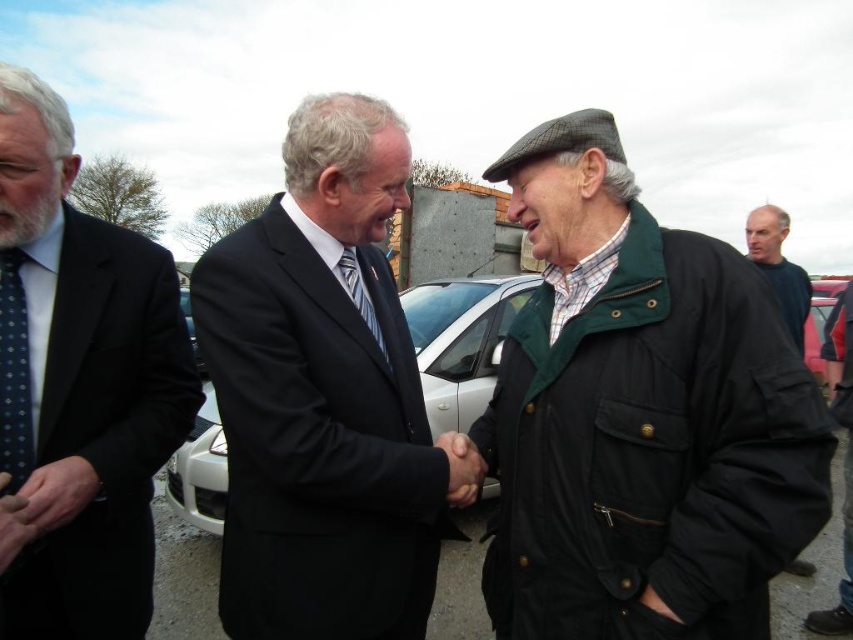
Between green textured jacket at center and dark blue dotted tie at left, which one appears on the right side from the viewer's perspective?

green textured jacket at center

Who is lower down, green textured jacket at center or dark blue dotted tie at left?

green textured jacket at center

Is point (666, 250) more distant than point (0, 404)?

Yes, it is behind point (0, 404).

The height and width of the screenshot is (640, 853). In order to click on green textured jacket at center in this screenshot , I will do `click(639, 417)`.

Based on the photo, does green textured jacket at center have a lesser height compared to polka dot silk tie at center?

Incorrect, green textured jacket at center's height does not fall short of polka dot silk tie at center's.

Is green textured jacket at center to the left of polka dot silk tie at center from the viewer's perspective?

In fact, green textured jacket at center is to the right of polka dot silk tie at center.

Which is in front, point (582, 609) or point (357, 296)?

Point (582, 609) is more forward.

Find the location of a particular element. The height and width of the screenshot is (640, 853). green textured jacket at center is located at coordinates (639, 417).

Can you confirm if polished dark suit at left is shorter than dark blue dotted tie at left?

In fact, polished dark suit at left may be taller than dark blue dotted tie at left.

Locate an element on the screen. polished dark suit at left is located at coordinates (80, 384).

Locate an element on the screen. polished dark suit at left is located at coordinates (80, 384).